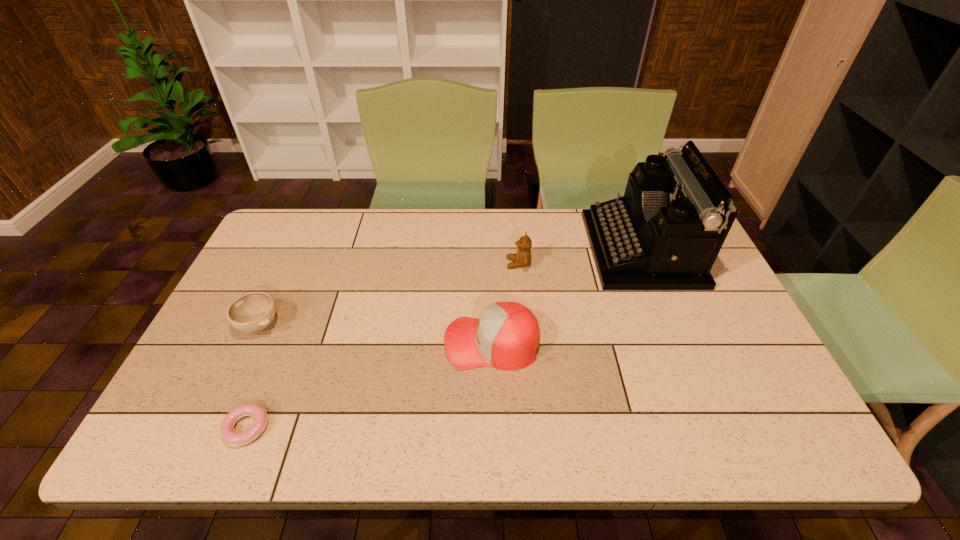
Locate an element on the screen. the rightmost object is located at coordinates 665,233.

Locate an element on the screen. typewriter is located at coordinates (665, 233).

In order to click on teddy bear in this screenshot , I will do `click(522, 258)`.

Identify the location of baseball cap. (506, 336).

You are a GUI agent. You are given a task and a screenshot of the screen. Output one action in this format:
    pyautogui.click(x=<x>, y=<y>)
    Task: Click on the bowl
    The height and width of the screenshot is (540, 960).
    Given the screenshot: What is the action you would take?
    pyautogui.click(x=252, y=312)

Find the location of a particular element. The height and width of the screenshot is (540, 960). doughnut is located at coordinates (228, 435).

Where is `the shortest object`? The image size is (960, 540). the shortest object is located at coordinates (228, 435).

Find the location of a particular element. vacant space located on the typing side of the tallest object is located at coordinates (467, 249).

Find the location of a particular element. free region located on the typing side of the tallest object is located at coordinates (469, 249).

Find the location of a particular element. The width and height of the screenshot is (960, 540). free space located on the typing side of the tallest object is located at coordinates (473, 249).